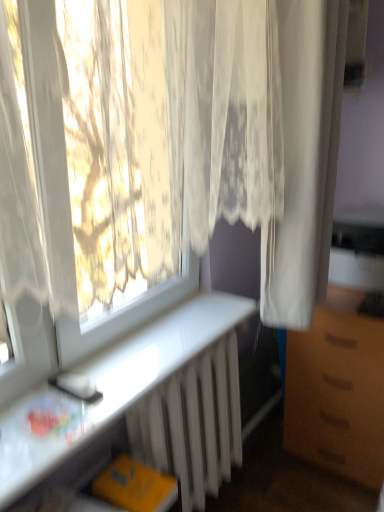
Question: From the image's perspective, is white sheer curtain at right, positioned as the second curtain in left-to-right order, below white metallic radiator at lower center?

Choices:
 (A) no
 (B) yes

Answer: (A)

Question: Does white sheer curtain at right, positioned as the second curtain in left-to-right order, have a greater width compared to white metallic radiator at lower center?

Choices:
 (A) yes
 (B) no

Answer: (A)

Question: Considering the relative sizes of white sheer curtain at right, positioned as the second curtain in left-to-right order, and white metallic radiator at lower center in the image provided, is white sheer curtain at right, positioned as the second curtain in left-to-right order, thinner than white metallic radiator at lower center?

Choices:
 (A) yes
 (B) no

Answer: (B)

Question: Considering the relative positions of white sheer curtain at right, positioned as the 1th curtain in right-to-left order, and white metallic radiator at lower center in the image provided, is white sheer curtain at right, positioned as the 1th curtain in right-to-left order, in front of white metallic radiator at lower center?

Choices:
 (A) no
 (B) yes

Answer: (B)

Question: Can we say white sheer curtain at right, positioned as the second curtain in left-to-right order, lies outside white metallic radiator at lower center?

Choices:
 (A) yes
 (B) no

Answer: (A)

Question: Is white sheer curtain at right, positioned as the second curtain in left-to-right order, to the right of white metallic radiator at lower center from the viewer's perspective?

Choices:
 (A) no
 (B) yes

Answer: (B)

Question: Is brown matte cabinet at right located within white metallic radiator at lower center?

Choices:
 (A) no
 (B) yes

Answer: (A)

Question: Is white metallic radiator at lower center facing away from brown matte cabinet at right?

Choices:
 (A) no
 (B) yes

Answer: (A)

Question: Is white metallic radiator at lower center to the right of brown matte cabinet at right from the viewer's perspective?

Choices:
 (A) yes
 (B) no

Answer: (B)

Question: Can you confirm if white metallic radiator at lower center is shorter than brown matte cabinet at right?

Choices:
 (A) no
 (B) yes

Answer: (B)

Question: Does white metallic radiator at lower center appear on the left side of brown matte cabinet at right?

Choices:
 (A) no
 (B) yes

Answer: (B)

Question: Is white metallic radiator at lower center positioned before brown matte cabinet at right?

Choices:
 (A) yes
 (B) no

Answer: (A)

Question: From the image's perspective, is brown matte cabinet at right beneath white metallic radiator at lower center?

Choices:
 (A) yes
 (B) no

Answer: (B)